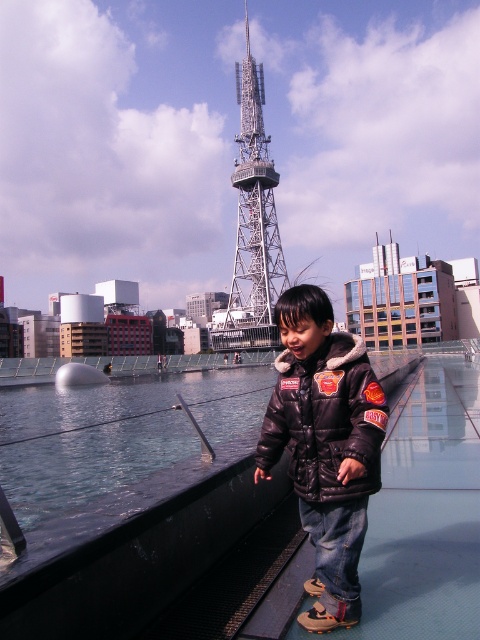
Identify the location of black fuzzy-lined jacket at center. (325, 419).

Is point (305, 422) more distant than point (232, 282)?

No.

Measure the distance between black fuzzy-lined jacket at center and camera.

black fuzzy-lined jacket at center and camera are 41.86 meters apart from each other.

Identify the location of black fuzzy-lined jacket at center. (325, 419).